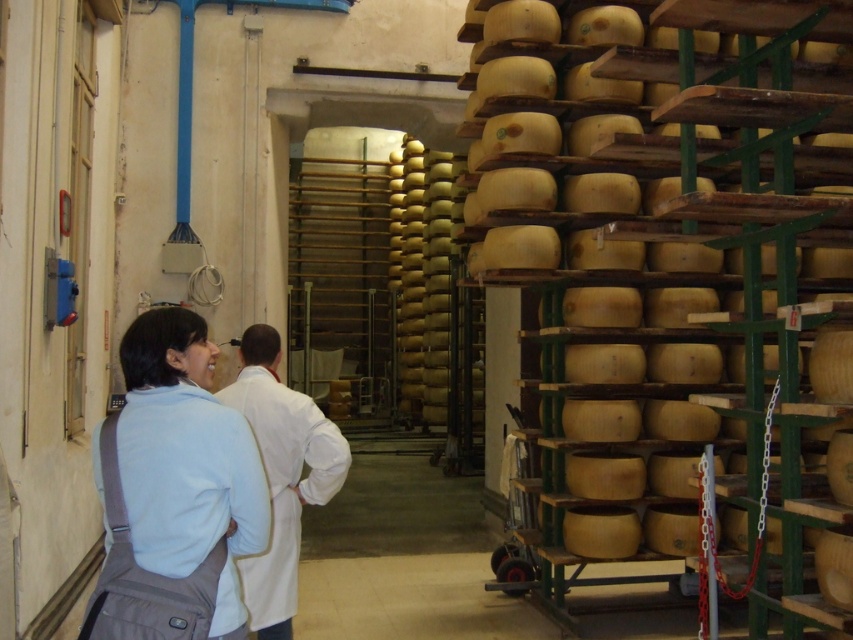
You are a quality inspector in the cheese facility. You need to check two points in the storage area. The first point is at coordinate point (798, 563) and the second is at point (242, 572). Which point is closer to you?

Point (798, 563) is further to the camera than point (242, 572), so the second point is closer to you.

You are an inspector in the cheese facility and need to determine which item at the center has a narrower width between the light blue fabric at center and the white lab coat at center. Based on the scene description, which one is narrower?

The light blue fabric at center has a lesser width compared to the white lab coat at center, so the light blue fabric at center is narrower.

You are a visitor in the cheese facility and want to take a photo of the wooden cheese at center and the white lab coat at center. Which object should you focus on first to ensure both are in the frame?

You should focus on the wooden cheese at center first because it is closer to you than the white lab coat at center, ensuring both are in the frame.